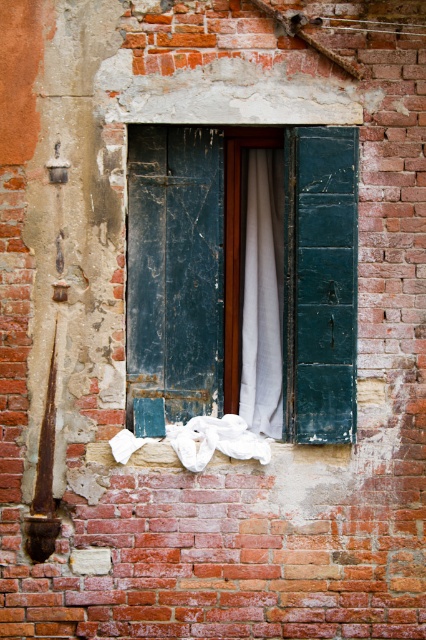
Who is positioned more to the left, teal wooden shutters at center or white fabric curtain at center?

From the viewer's perspective, teal wooden shutters at center appears more on the left side.

From the picture: Can you confirm if teal wooden shutters at center is positioned below white fabric curtain at center?

Incorrect, teal wooden shutters at center is not positioned below white fabric curtain at center.

Does point (186, 285) lie in front of point (256, 307)?

Yes, point (186, 285) is closer to viewer.

This screenshot has height=640, width=426. I want to click on teal wooden shutters at center, so click(176, 268).

Is white fabric curtain at center wider than white cotton cloth at lower center?

A: No.

Find the location of a particular element. white fabric curtain at center is located at coordinates (262, 294).

This screenshot has width=426, height=640. Identify the location of teal wooden shutters at center. (176, 268).